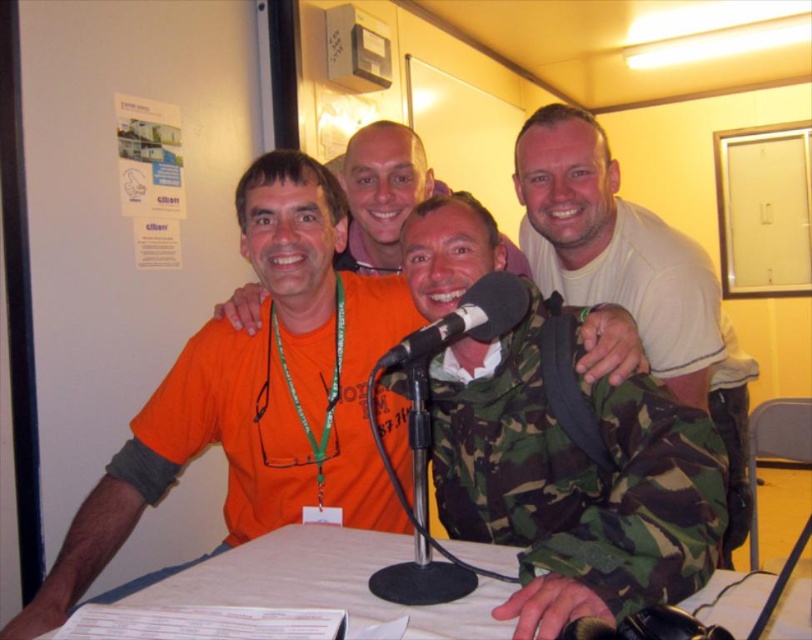
Question: Is camouflage fabric shirt at center above camouflage fabric backpack at right?

Choices:
 (A) yes
 (B) no

Answer: (B)

Question: Among these objects, which one is farthest from the camera?

Choices:
 (A) camouflage fabric backpack at right
 (B) black matte microphone at center
 (C) camouflage fabric shirt at center
 (D) white paper at center

Answer: (A)

Question: Which object is the closest to the camouflage fabric backpack at right?

Choices:
 (A) camouflage fabric shirt at center
 (B) black matte microphone at center
 (C) white paper at center

Answer: (A)

Question: Can you confirm if white paper at center is positioned to the left of black matte microphone at center?

Choices:
 (A) no
 (B) yes

Answer: (B)

Question: Which point is closer to the camera taking this photo?

Choices:
 (A) (197, 564)
 (B) (389, 369)

Answer: (A)

Question: Is camouflage fabric backpack at right below black matte microphone at center?

Choices:
 (A) yes
 (B) no

Answer: (A)